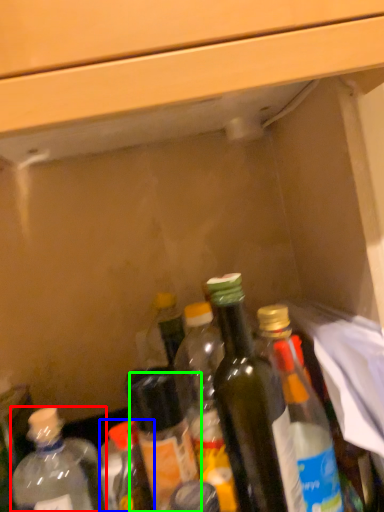
Question: Which object is the closest to the bottle (highlighted by a red box)? Choose among these: bottle (highlighted by a blue box) or bottle (highlighted by a green box).

Choices:
 (A) bottle
 (B) bottle

Answer: (A)